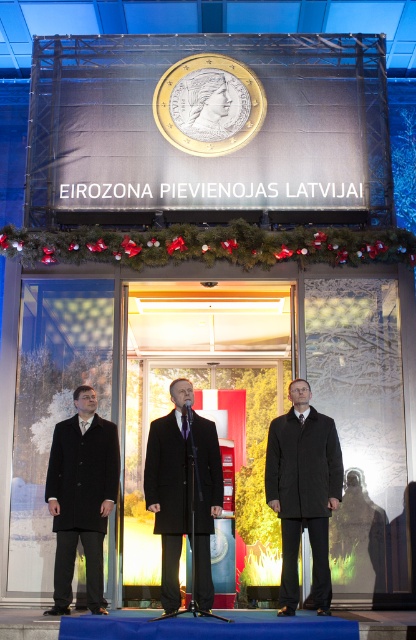
Question: Is dark gray wool coat at center closer to camera compared to matte black coat at left?

Choices:
 (A) yes
 (B) no

Answer: (A)

Question: Which object is positioned farthest from the matte black coat at left?

Choices:
 (A) black matte suit at center
 (B) dark gray wool coat at center

Answer: (B)

Question: Which point is farther from the camera taking this photo?

Choices:
 (A) (287, 513)
 (B) (69, 540)

Answer: (A)

Question: Considering the relative positions of matte black coat at left and black matte suit at center in the image provided, where is matte black coat at left located with respect to black matte suit at center?

Choices:
 (A) above
 (B) below

Answer: (B)

Question: Which object is farther from the camera taking this photo?

Choices:
 (A) matte black coat at left
 (B) dark gray wool coat at center

Answer: (A)

Question: Does matte black coat at left appear over black matte suit at center?

Choices:
 (A) yes
 (B) no

Answer: (B)